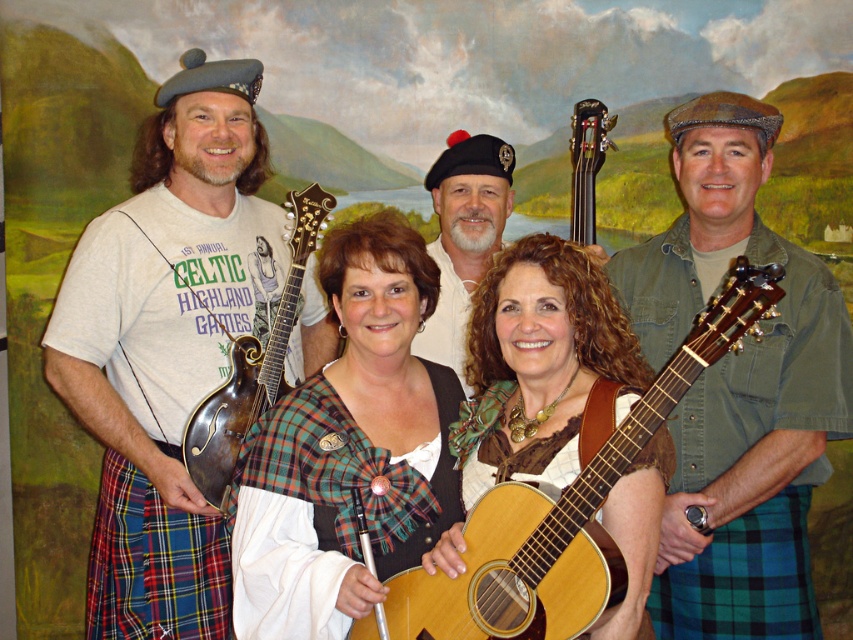
Question: Does plaid fabric vest at center appear on the left side of green plaid kilt at lower right?

Choices:
 (A) no
 (B) yes

Answer: (B)

Question: Which is nearer to the plaid fabric vest at center?

Choices:
 (A) green plaid kilt at lower right
 (B) green denim shirt at center
 (C) polished dark wood guitar at upper center

Answer: (B)

Question: Does green denim shirt at center appear under polished dark wood guitar at upper center?

Choices:
 (A) no
 (B) yes

Answer: (B)

Question: Which of the following is the farthest from the observer?

Choices:
 (A) wooden acoustic guitar at center
 (B) plaid fabric vest at center

Answer: (B)

Question: Does matte gray beret at left appear on the left side of wooden mandolin at left?

Choices:
 (A) yes
 (B) no

Answer: (A)

Question: Among these points, which one is nearest to the camera?

Choices:
 (A) (131, 592)
 (B) (688, 628)

Answer: (B)